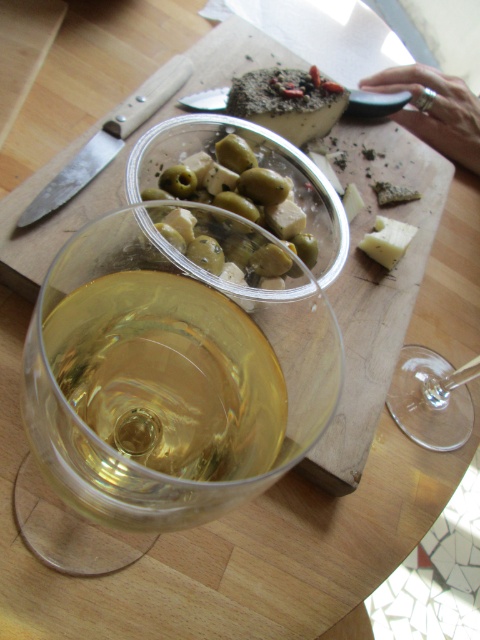
Question: Is transparent glass at lower right further to the viewer compared to white crumbly cheese at center-right?

Choices:
 (A) no
 (B) yes

Answer: (A)

Question: Which point is closer to the camera?

Choices:
 (A) crumbly cheese at center
 (B) white crumbly cheese at center-right
 (C) silver ring at upper right

Answer: (A)

Question: Which point appears closest to the camera in this image?

Choices:
 (A) (456, 424)
 (B) (372, 253)
 (C) (279, 72)
 (D) (64, 524)

Answer: (D)

Question: Can you confirm if transparent glass wine at center is thinner than transparent glass at lower right?

Choices:
 (A) no
 (B) yes

Answer: (A)

Question: Is transparent glass wine at center to the right of silver ring at upper right from the viewer's perspective?

Choices:
 (A) no
 (B) yes

Answer: (A)

Question: Which point is closer to the camera?

Choices:
 (A) (393, 225)
 (B) (259, 168)
 (C) (317, 122)

Answer: (B)